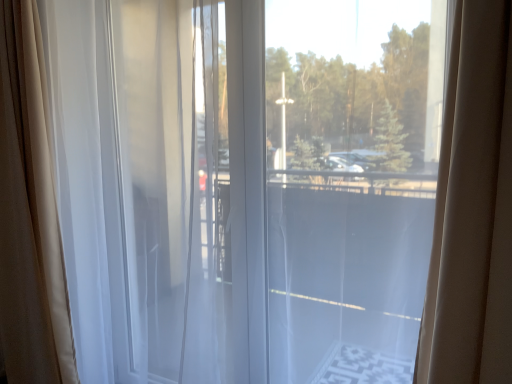
Question: Is sheer white curtain at left, which ranks as the 1th curtain in left-to-right order, inside or outside of transparent glass window at center?

Choices:
 (A) outside
 (B) inside

Answer: (A)

Question: Is sheer white curtain at left, arranged as the 2th curtain when viewed from the right, in front of or behind transparent glass window at center in the image?

Choices:
 (A) behind
 (B) front

Answer: (A)

Question: Based on their relative distances, which object is farther from the white sheer curtain at left, the second curtain from the left?

Choices:
 (A) sheer white curtain at left, which ranks as the 1th curtain in left-to-right order
 (B) transparent glass window at center

Answer: (B)

Question: Which is farther from the white sheer curtain at left, the second curtain from the left?

Choices:
 (A) sheer white curtain at left, arranged as the 2th curtain when viewed from the right
 (B) transparent glass window at center

Answer: (B)